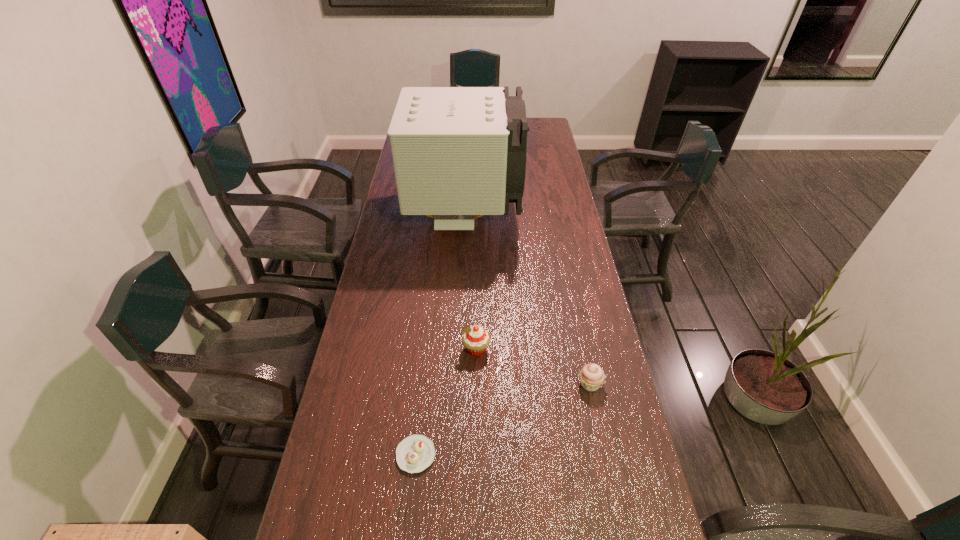
In order to click on fan in this screenshot , I will do `click(457, 152)`.

The image size is (960, 540). In order to click on the farthest object in this screenshot , I will do `click(457, 152)`.

The width and height of the screenshot is (960, 540). In order to click on the farthest cupcake in this screenshot , I will do `click(475, 339)`.

This screenshot has width=960, height=540. Find the location of `the third shortest object`. the third shortest object is located at coordinates (475, 339).

Locate an element on the screen. The image size is (960, 540). the second shortest object is located at coordinates (591, 376).

Locate an element on the screen. the second nearest cupcake is located at coordinates (591, 376).

The width and height of the screenshot is (960, 540). Find the location of `the nearest cupcake`. the nearest cupcake is located at coordinates (415, 453).

Where is `the shortest object`? This screenshot has height=540, width=960. the shortest object is located at coordinates (415, 453).

Where is `free region located on the front of the tallest object`? The height and width of the screenshot is (540, 960). free region located on the front of the tallest object is located at coordinates point(463,257).

Locate an element on the screen. The width and height of the screenshot is (960, 540). free location located on the front of the second tallest object is located at coordinates (475, 500).